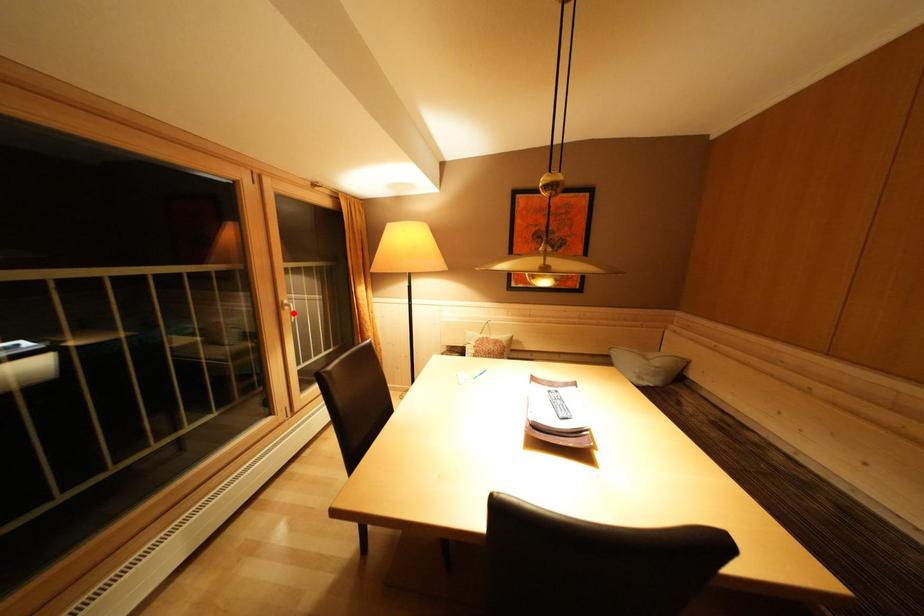
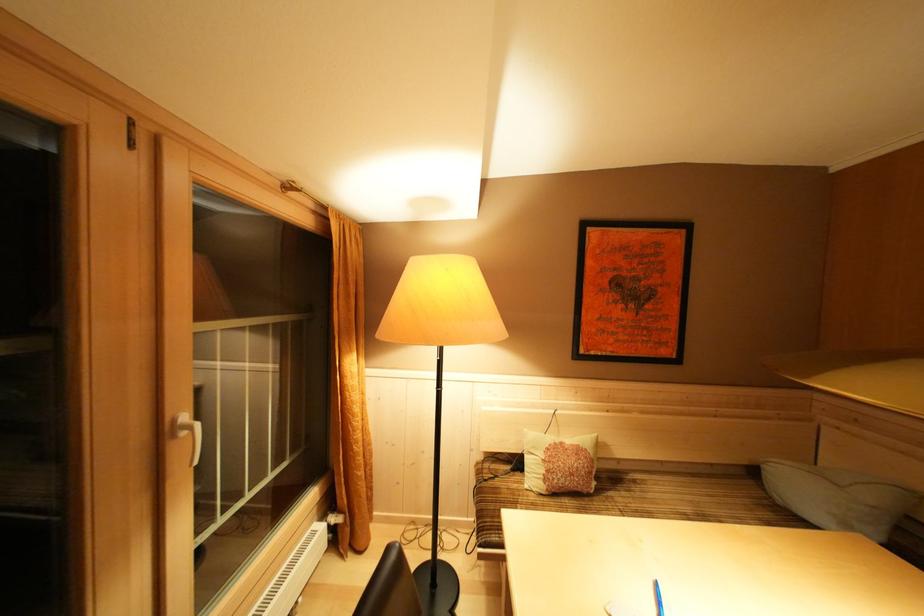
Question: A red point is marked in image1. In image2, is the corresponding 3D point closer to the camera or farther? Reply with the corresponding letter.

Choices:
 (A) The corresponding 3D point is closer.
 (B) The corresponding 3D point is farther.

Answer: (B)